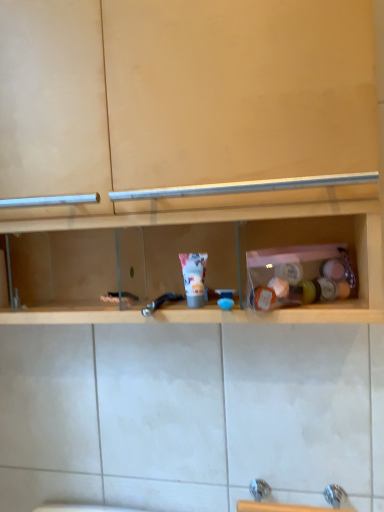
Question: Is white matte tube at center touching metallic blue faucet at center?

Choices:
 (A) yes
 (B) no

Answer: (A)

Question: Does white matte tube at center have a larger size compared to metallic blue faucet at center?

Choices:
 (A) yes
 (B) no

Answer: (A)

Question: Can you confirm if white matte tube at center is thinner than metallic blue faucet at center?

Choices:
 (A) yes
 (B) no

Answer: (A)

Question: Considering the relative sizes of white matte tube at center and metallic blue faucet at center in the image provided, is white matte tube at center smaller than metallic blue faucet at center?

Choices:
 (A) yes
 (B) no

Answer: (B)

Question: Is white matte tube at center turned away from metallic blue faucet at center?

Choices:
 (A) no
 (B) yes

Answer: (A)

Question: Relative to wooden shelf at center, is white matte tube at center in front or behind?

Choices:
 (A) behind
 (B) front

Answer: (A)

Question: Is white matte tube at center situated inside wooden shelf at center or outside?

Choices:
 (A) outside
 (B) inside

Answer: (B)

Question: From a real-world perspective, is white matte tube at center positioned above or below wooden shelf at center?

Choices:
 (A) below
 (B) above

Answer: (A)

Question: From the image's perspective, is white matte tube at center located above or below wooden shelf at center?

Choices:
 (A) below
 (B) above

Answer: (A)

Question: Would you say metallic blue faucet at center is inside or outside white matte tube at center?

Choices:
 (A) inside
 (B) outside

Answer: (B)

Question: Is metallic blue faucet at center taller or shorter than white matte tube at center?

Choices:
 (A) short
 (B) tall

Answer: (A)

Question: Does point (155, 300) appear closer or farther from the camera than point (190, 278)?

Choices:
 (A) farther
 (B) closer

Answer: (A)

Question: Considering the positions of metallic blue faucet at center and white matte tube at center in the image, is metallic blue faucet at center bigger or smaller than white matte tube at center?

Choices:
 (A) small
 (B) big

Answer: (A)

Question: In the image, is wooden shelf at center positioned in front of or behind metallic blue faucet at center?

Choices:
 (A) front
 (B) behind

Answer: (A)

Question: From the image's perspective, is wooden shelf at center positioned above or below metallic blue faucet at center?

Choices:
 (A) above
 (B) below

Answer: (A)